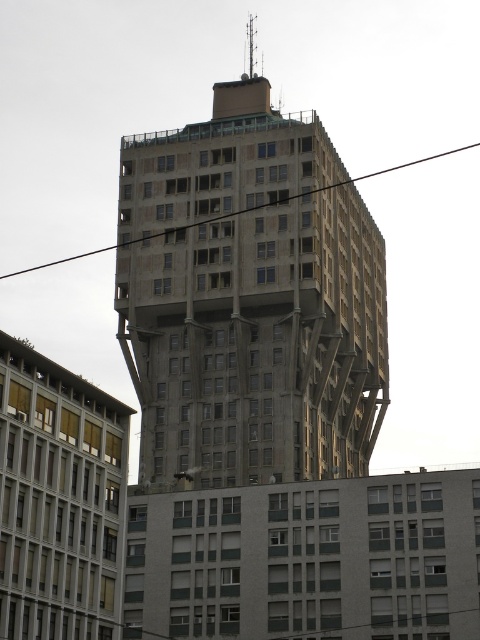
Question: Does concrete building at center appear over black wire at upper center?

Choices:
 (A) yes
 (B) no

Answer: (A)

Question: Can you confirm if concrete building at center is thinner than black wire at upper center?

Choices:
 (A) no
 (B) yes

Answer: (B)

Question: Does concrete building at center lie behind black wire at upper center?

Choices:
 (A) yes
 (B) no

Answer: (B)